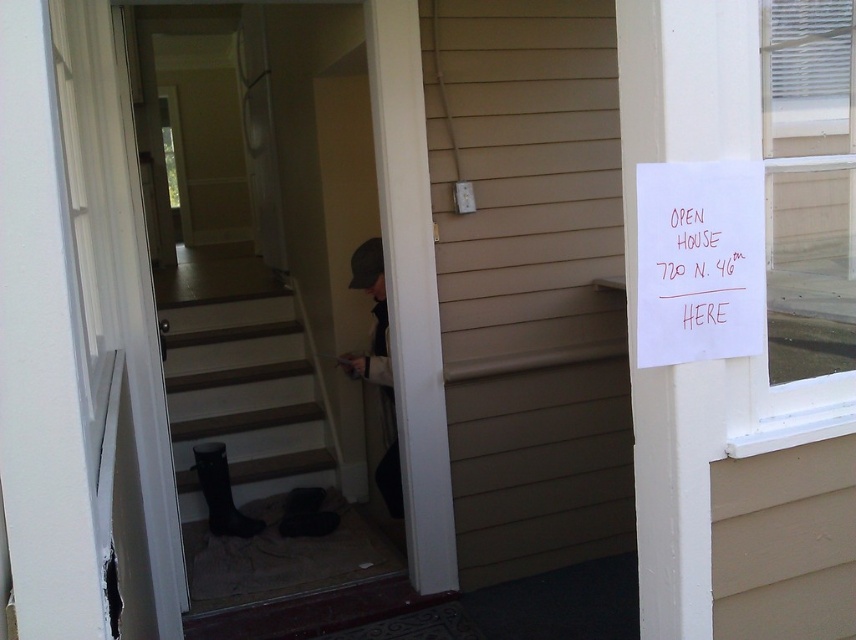
You are a delivery person with a 1.2 meter wide cart. You need to pass through the entrance of the house to deliver a package. Is there enough space between the black rubber stair at lower left and the red paper sign at upper right to fit your cart?

The black rubber stair at lower left might be wider than red paper sign at upper right, so there may be sufficient space for the 1.2 meter wide cart to pass through. However, since the exact width isn not specified, it is recommended to check the actual dimensions before proceeding.

You are a delivery person at the entrance of the house. You need to place a package on the black rubber stair at lower left and the dark gray knit hat at center. Which object should you place the package on first?

The black rubber stair at lower left is closer to you than the dark gray knit hat at center, so you should place the package on the black rubber stair at lower left first.

You are a guest arriving at the house and want to read the sign on the door. However, there is a white paper at upper right and a red paper sign at upper right. Which one is closer to you as you stand at the entrance?

The white paper at upper right is in front of the red paper sign at upper right, so the white paper at upper right is closer to you.